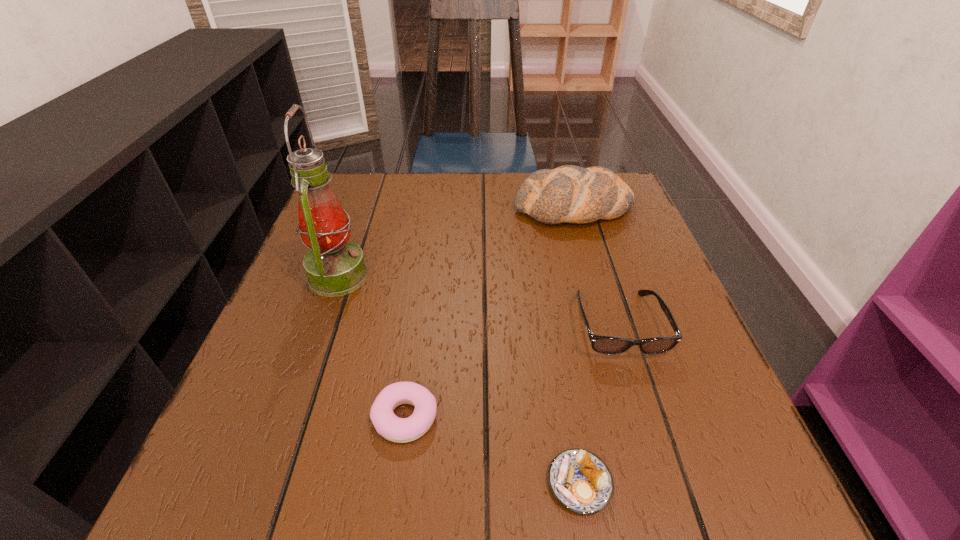
This screenshot has height=540, width=960. I want to click on empty location between the tallest object and the taller pastry, so click(372, 347).

At what (x,y) coordinates should I click in order to perform the action: click on empty space between the tallest object and the nearer pastry. Please return your answer as a coordinate pair (x, y). This screenshot has width=960, height=540. Looking at the image, I should click on (459, 380).

Find the location of a particular element. Image resolution: width=960 pixels, height=540 pixels. free space between the fourth shortest object and the third tallest object is located at coordinates (596, 267).

Where is `vacant space that is in between the left pastry and the spectacles`? This screenshot has height=540, width=960. vacant space that is in between the left pastry and the spectacles is located at coordinates (512, 371).

Where is `vacant space that's between the farthest object and the farther pastry`? This screenshot has height=540, width=960. vacant space that's between the farthest object and the farther pastry is located at coordinates (490, 313).

Image resolution: width=960 pixels, height=540 pixels. In order to click on free point between the third shortest object and the fourth tallest object in this screenshot , I will do `click(512, 371)`.

Choose which object is the third nearest neighbor to the farther pastry. Please provide its 2D coordinates. Your answer should be formatted as a tuple, i.e. [(x, y)], where the tuple contains the x and y coordinates of a point satisfying the conditions above.

[(609, 345)]

Locate which object is the third closest to the tallest object. Please provide its 2D coordinates. Your answer should be formatted as a tuple, i.e. [(x, y)], where the tuple contains the x and y coordinates of a point satisfying the conditions above.

[(609, 345)]